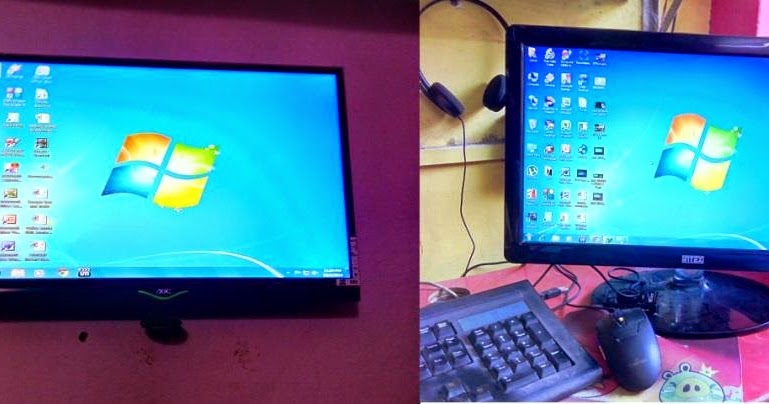
You are a GUI agent. You are given a task and a screenshot of the screen. Output one action in this format:
    pyautogui.click(x=<x>, y=<y>)
    Task: Click on the desk
    The height and width of the screenshot is (404, 769).
    Given the screenshot: What is the action you would take?
    click(x=753, y=363), click(x=494, y=279)